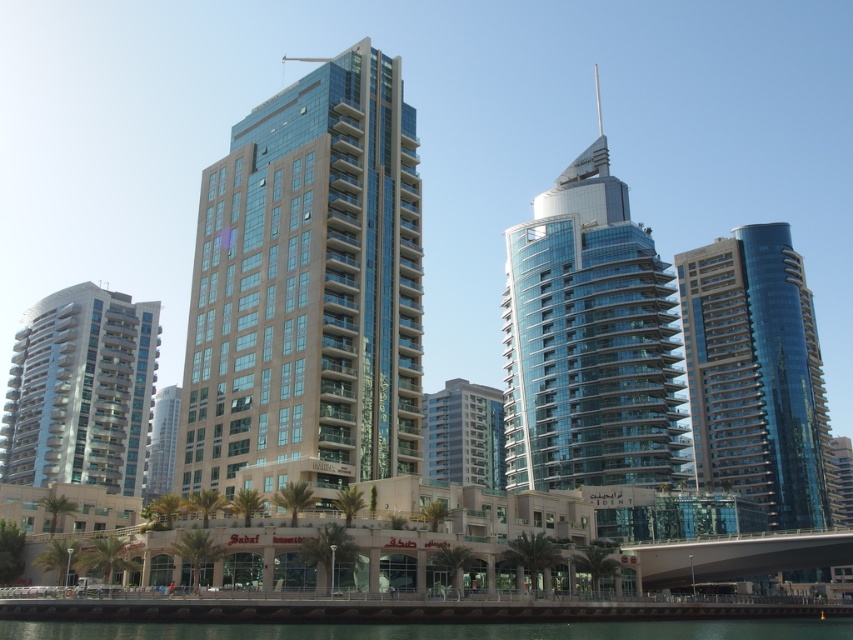
Question: Considering the real-world distances, which object is farthest from the shiny glass skyscraper at center?

Choices:
 (A) transparent glass water at lower center
 (B) matte glass tower at center
 (C) matte glass building at left
 (D) beige glass building at center

Answer: (B)

Question: Among these points, which one is farthest from the camera?

Choices:
 (A) (364, 634)
 (B) (107, 472)

Answer: (B)

Question: Is glassy blue building at center to the left of matte glass tower at center from the viewer's perspective?

Choices:
 (A) no
 (B) yes

Answer: (A)

Question: Among these points, which one is nearest to the camera?

Choices:
 (A) (59, 625)
 (B) (166, 420)

Answer: (A)

Question: Is transparent glass water at lower center closer to the viewer compared to matte glass tower at center?

Choices:
 (A) yes
 (B) no

Answer: (A)

Question: Is beige glass building at center thinner than transparent glass water at lower center?

Choices:
 (A) yes
 (B) no

Answer: (A)